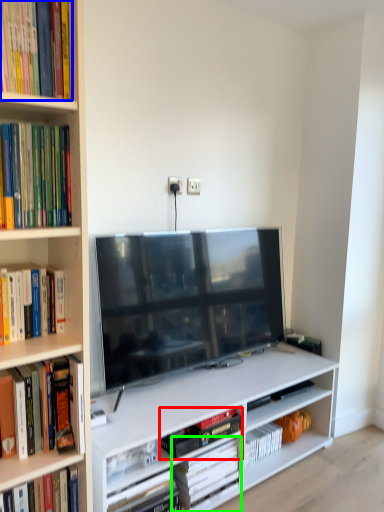
Question: Based on their relative distances, which object is farther from book (highlighted by a red box)? Choose from book (highlighted by a blue box) and book (highlighted by a green box).

Choices:
 (A) book
 (B) book

Answer: (A)